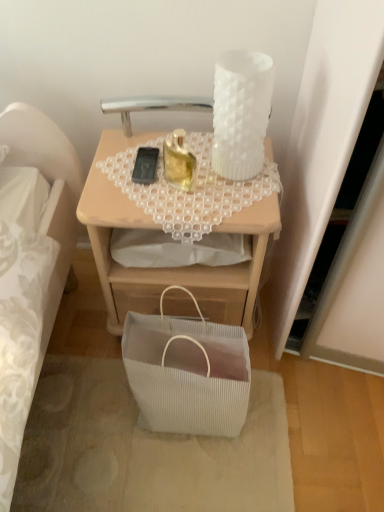
Identify the location of vacant area on the back side of translucent glass candle at upper center, arranged as the second candle holder when viewed from the right. The width and height of the screenshot is (384, 512). (181, 148).